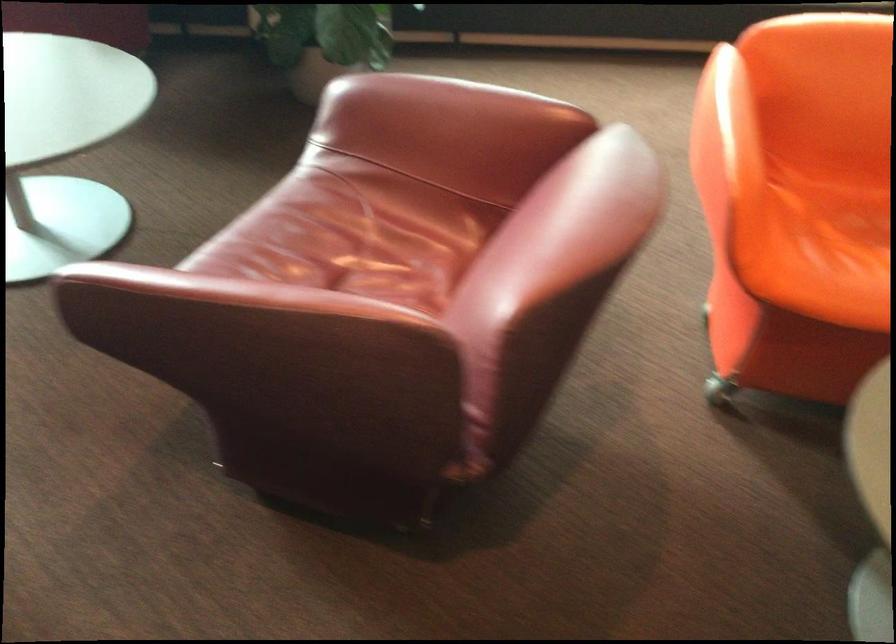
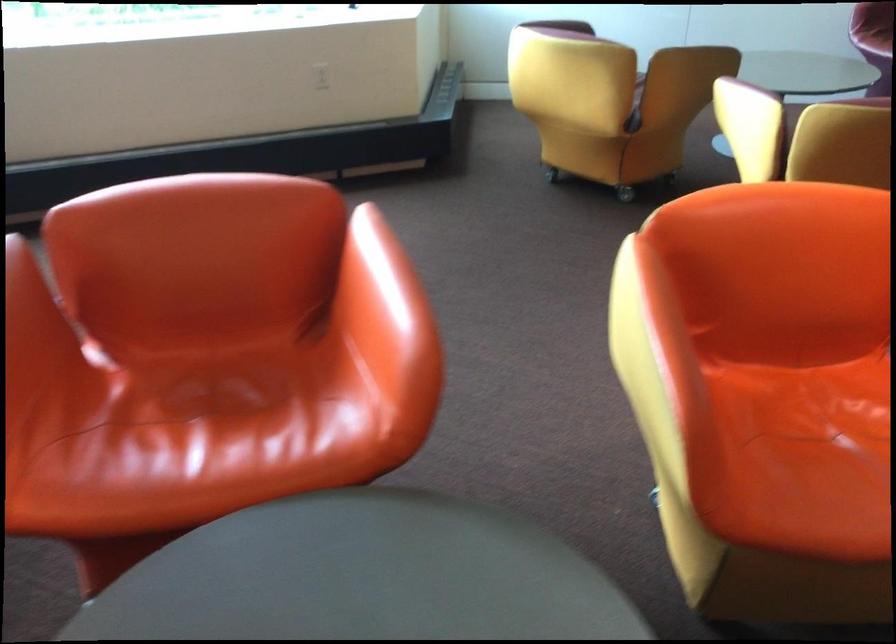
Question: What movement of the cameraman would produce the second image?

Choices:
 (A) Left
 (B) Right
 (C) Forward
 (D) Backward

Answer: (B)